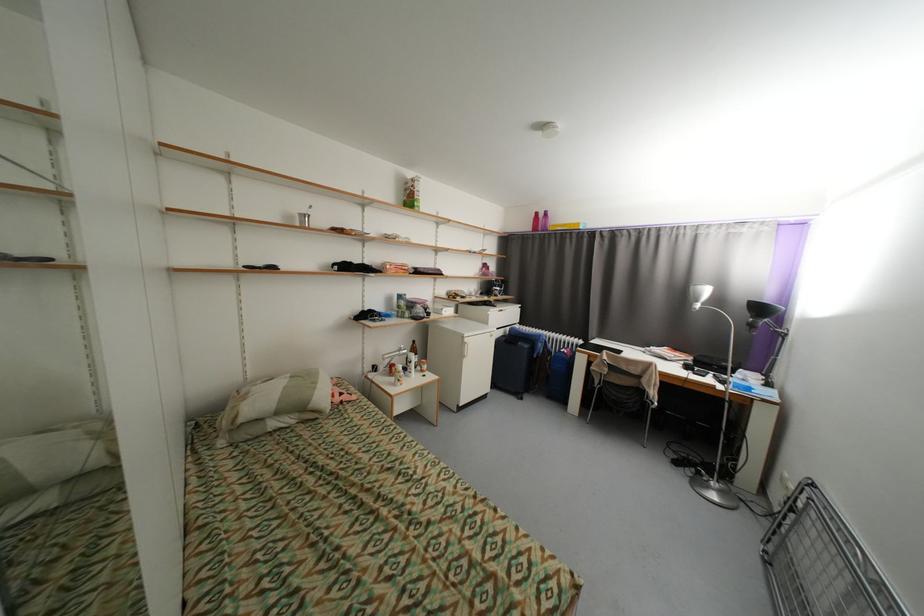
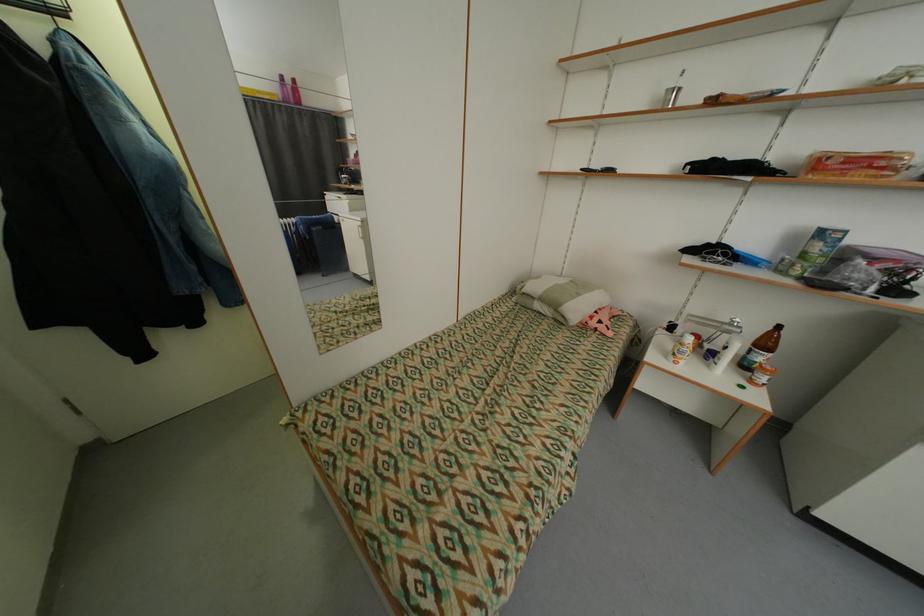
The point at (414, 378) is marked in the first image. Where is the corresponding point in the second image?

(714, 367)